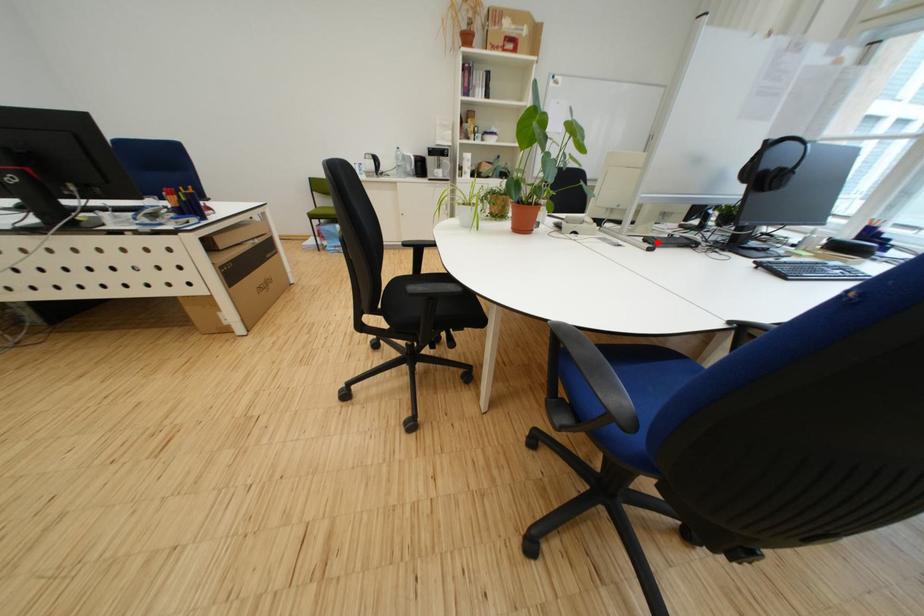
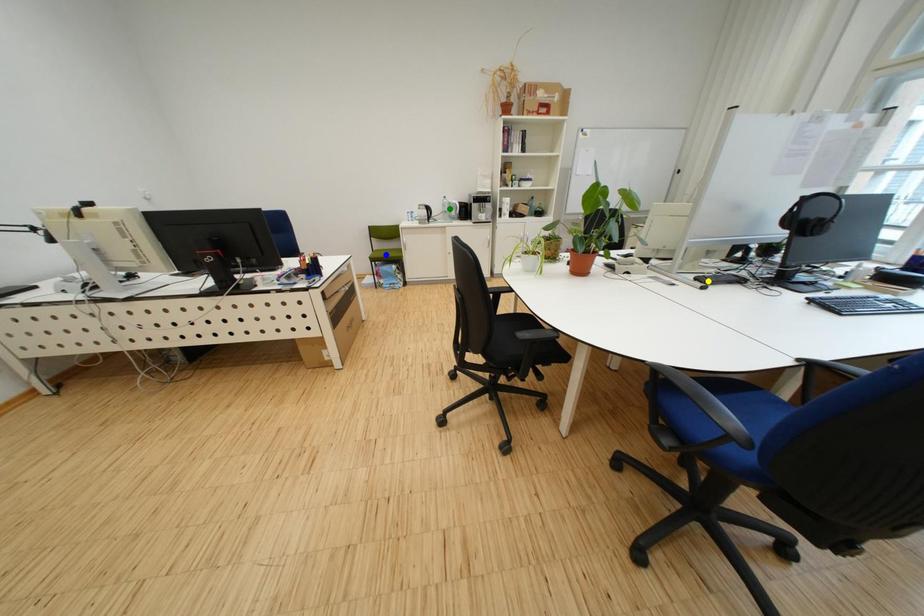
Question: I am providing you with two images of the same scene from different viewpoints. A red point is marked on the first image. You are given multiple points on the second image. In image 2, which mark is for the same physical point as the one in image 1?

Choices:
 (A) green point
 (B) yellow point
 (C) blue point

Answer: (B)